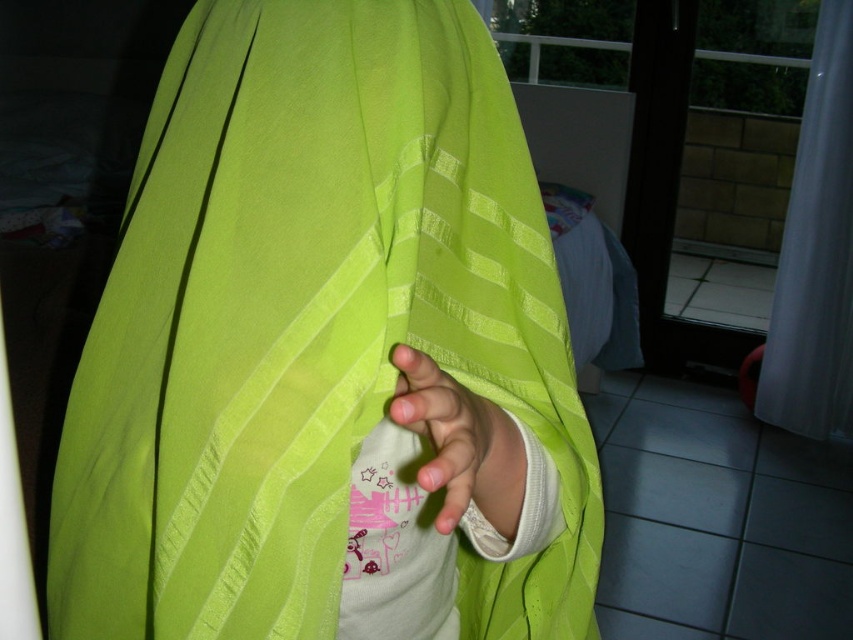
You are a photographer setting up a shoot in the room. You need to position a 2.5 meter long backdrop stand between the white sheer curtain at right and the matte green fabric at lower center. Is there enough space for the backdrop stand between them?

The distance between the white sheer curtain at right and the matte green fabric at lower center is 2.41 meters, which is slightly shorter than the 2.5 meter backdrop stand. Therefore, there is not enough space to fit the backdrop stand between them.

You are taking a photo of the scene and want to focus on the point closer to the camera. Which point should you choose between point (379, 156) and point (401, 422)?

Point (379, 156) is further to the camera than point (401, 422), so you should choose point (379, 156) to focus on the closer point.

You are trying to decide whether to hang a new decorative tapestry that is 2 meters wide. You see the white sheer curtain at right and the matte green fabric at lower center in the scene. Based on their widths, which object could potentially accommodate the tapestry if placed beside it?

The white sheer curtain at right might be wider than matte green fabric at lower center, so the tapestry could potentially fit beside the white sheer curtain at right since it is wider.